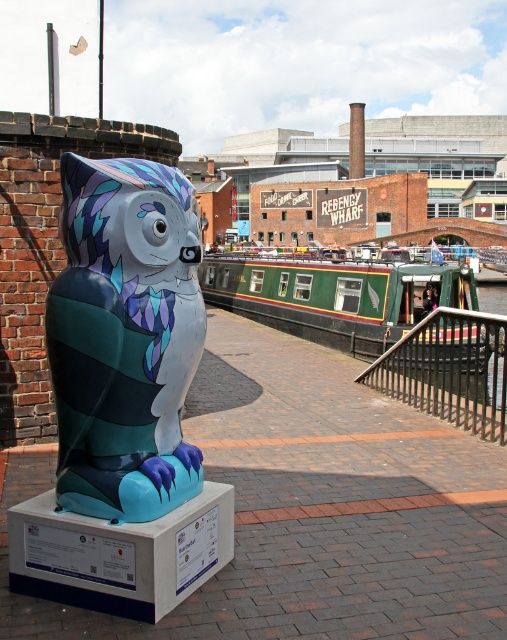
Which of these two, shiny metallic cat at center or black metal/rail at lower right, stands taller?

Standing taller between the two is shiny metallic cat at center.

Who is more distant from viewer, [189,316] or [427,410]?

Point [427,410]

The height and width of the screenshot is (640, 507). Describe the element at coordinates (125, 339) in the screenshot. I see `shiny metallic cat at center` at that location.

Image resolution: width=507 pixels, height=640 pixels. Find the location of `shiny metallic cat at center`. shiny metallic cat at center is located at coordinates (125, 339).

Does shiny metallic cat at center appear over green polished wood barge at center?

Incorrect, shiny metallic cat at center is not positioned above green polished wood barge at center.

Measure the distance between shiny metallic cat at center and green polished wood barge at center.

10.61 meters

Is point (142, 480) farther from camera compared to point (450, 296)?

No, (142, 480) is in front of (450, 296).

You are a GUI agent. You are given a task and a screenshot of the screen. Output one action in this format:
    pyautogui.click(x=<x>, y=<y>)
    Task: Click on the shiny metallic cat at center
    
    Given the screenshot: What is the action you would take?
    pyautogui.click(x=125, y=339)

Can you confirm if green polished wood barge at center is positioned to the right of black metal/rail at lower right?

Incorrect, green polished wood barge at center is not on the right side of black metal/rail at lower right.

Can you confirm if green polished wood barge at center is positioned below black metal/rail at lower right?

Incorrect, green polished wood barge at center is not positioned below black metal/rail at lower right.

Who is more forward, (342,332) or (445,376)?

Positioned in front is point (445,376).

Identify the location of green polished wood barge at center. Image resolution: width=507 pixels, height=640 pixels. (335, 296).